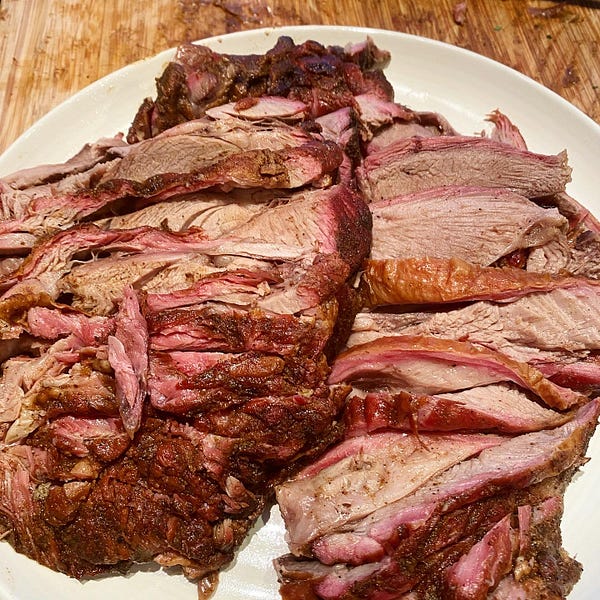
Identify the location of table. The image size is (600, 600). (63, 32).